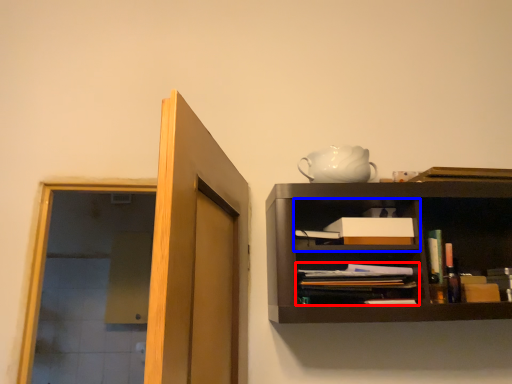
Question: Which point is closer to the camera, book (highlighted by a red box) or cabinet (highlighted by a blue box)?

Choices:
 (A) book
 (B) cabinet

Answer: (A)